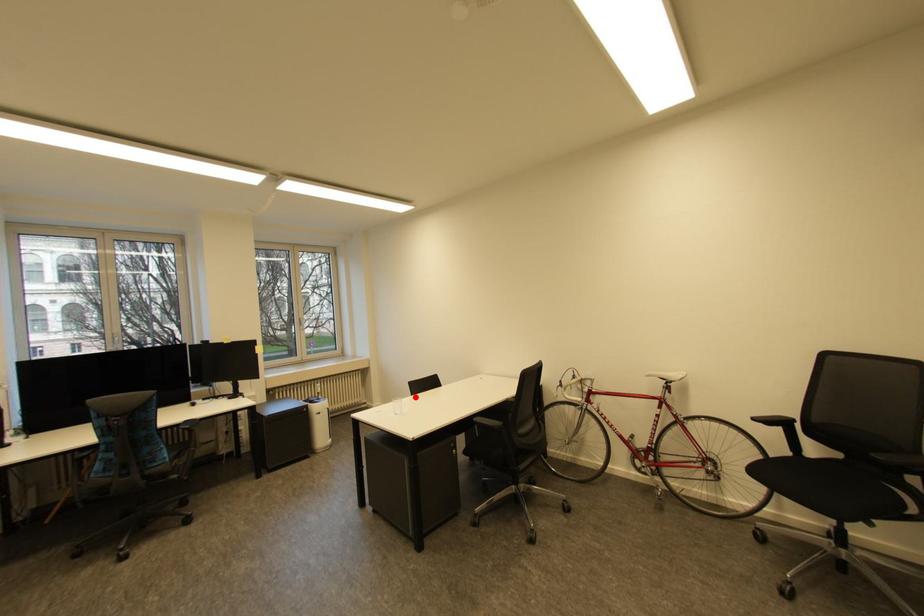
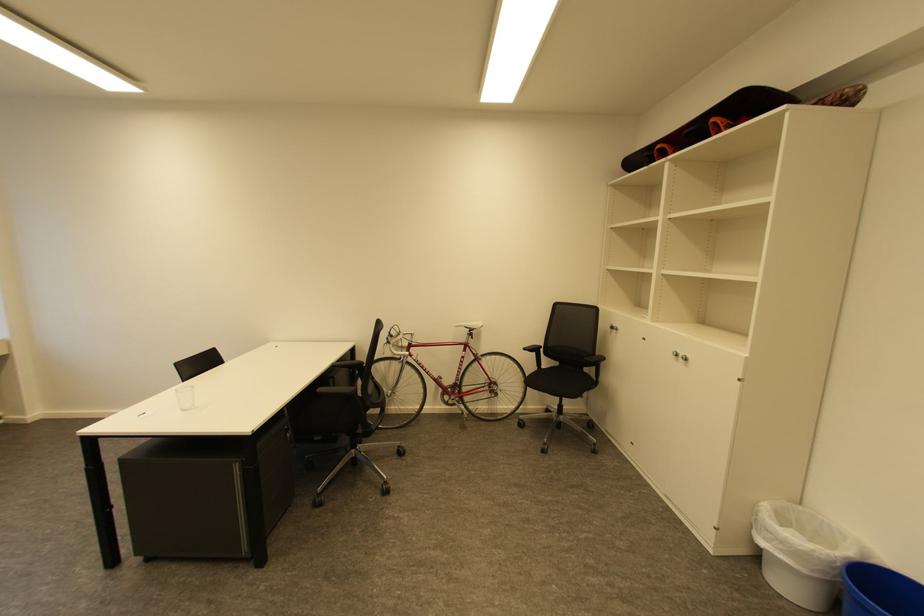
Find the pixel in the second image that matches the highlighted location in the first image.

(185, 384)